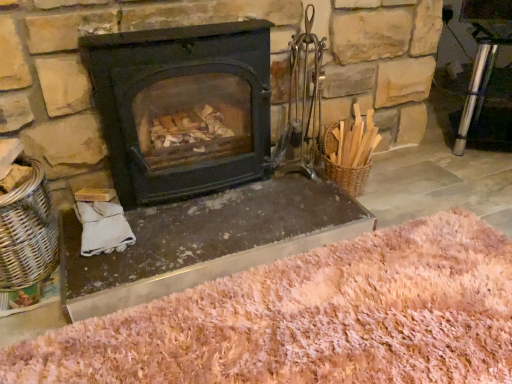
Measure the distance between point (321,204) and camera.

The depth of point (321,204) is 5.09 feet.

Where is `pink shaggy rug at lower center`? The width and height of the screenshot is (512, 384). pink shaggy rug at lower center is located at coordinates (310, 319).

Which is in front, matte black wood burning stove at center or woven wicker basket at left?

woven wicker basket at left is in front.

Does point (117, 50) lie behind point (41, 224)?

No, (117, 50) is closer to viewer.

Is matte black wood burning stove at center oriented away from woven wicker basket at left?

No, matte black wood burning stove at center is not facing away from woven wicker basket at left.

Which of these two, matte black wood burning stove at center or woven wicker basket at left, is thinner?

With smaller width is matte black wood burning stove at center.

How different are the orientations of woven wicker basket at left and metallic gray fireplace at center in degrees?

87.9 degrees separate the facing orientations of woven wicker basket at left and metallic gray fireplace at center.

Does woven wicker basket at left appear on the left side of metallic gray fireplace at center?

Yes, woven wicker basket at left is to the left of metallic gray fireplace at center.

Are woven wicker basket at left and metallic gray fireplace at center making contact?

No.

In order to click on table that is behind the woven wicker basket at left in this screenshot , I will do `click(205, 241)`.

Can you confirm if matte black wood burning stove at center is taller than pink shaggy rug at lower center?

Yes.

Between matte black wood burning stove at center and pink shaggy rug at lower center, which one has smaller width?

A: With smaller width is matte black wood burning stove at center.

Is matte black wood burning stove at center at the left side of pink shaggy rug at lower center?

Correct, you'll find matte black wood burning stove at center to the left of pink shaggy rug at lower center.

Is matte black wood burning stove at center beside pink shaggy rug at lower center?

No.

Is pink shaggy rug at lower center in front of or behind metallic gray fireplace at center in the image?

pink shaggy rug at lower center is positioned closer to the viewer than metallic gray fireplace at center.

From the image's perspective, relative to metallic gray fireplace at center, is pink shaggy rug at lower center above or below?

pink shaggy rug at lower center is situated lower than metallic gray fireplace at center in the image.

What's the angular difference between metallic gray fireplace at center and matte black wood burning stove at center's facing directions?

metallic gray fireplace at center and matte black wood burning stove at center are facing 93.1 degrees away from each other.

Does metallic gray fireplace at center have a lesser width compared to matte black wood burning stove at center?

In fact, metallic gray fireplace at center might be wider than matte black wood burning stove at center.

Can matte black wood burning stove at center be found inside metallic gray fireplace at center?

No, matte black wood burning stove at center is located outside of metallic gray fireplace at center.

Does metallic gray fireplace at center turn towards matte black wood burning stove at center?

No, metallic gray fireplace at center is not facing towards matte black wood burning stove at center.

Considering the positions of point (13, 241) and point (129, 97), is point (13, 241) closer or farther from the camera than point (129, 97)?

Point (13, 241).

Image resolution: width=512 pixels, height=384 pixels. I want to click on basket that appears on the left of matte black wood burning stove at center, so click(x=27, y=231).

Between woven wicker basket at left and matte black wood burning stove at center, which one appears on the right side from the viewer's perspective?

matte black wood burning stove at center.

From the image's perspective, does pink shaggy rug at lower center appear lower than woven wicker basket at left?

Yes.

Does pink shaggy rug at lower center contain woven wicker basket at left?

Definitely not — woven wicker basket at left is not inside pink shaggy rug at lower center.

Consider the image. Is pink shaggy rug at lower center facing towards woven wicker basket at left?

No.

Who is taller, pink shaggy rug at lower center or woven wicker basket at left?

With more height is woven wicker basket at left.

You are a GUI agent. You are given a task and a screenshot of the screen. Output one action in this format:
    pyautogui.click(x=<x>, y=<y>)
    Task: Click on the wood burning stove behind the woven wicker basket at left
    The image size is (512, 384).
    Given the screenshot: What is the action you would take?
    pyautogui.click(x=182, y=108)

In the image, there is a woven wicker basket at left. Where is `table below it (from the image's perspective)`? Image resolution: width=512 pixels, height=384 pixels. table below it (from the image's perspective) is located at coordinates (205, 241).

When comparing their distances from metallic gray fireplace at center, does pink shaggy rug at lower center or woven wicker basket at left seem closer?

Based on the image, pink shaggy rug at lower center appears to be nearer to metallic gray fireplace at center.

Based on their spatial positions, is metallic gray fireplace at center or matte black wood burning stove at center closer to woven wicker basket at left?

metallic gray fireplace at center is closer to woven wicker basket at left.

Estimate the real-world distances between objects in this image. Which object is closer to woven wicker basket at left, matte black wood burning stove at center or pink shaggy rug at lower center?

matte black wood burning stove at center is closer to woven wicker basket at left.

Considering their positions, is pink shaggy rug at lower center positioned closer to matte black wood burning stove at center than woven wicker basket at left?

woven wicker basket at left.

From the picture: From the image, which object appears to be farther from pink shaggy rug at lower center, metallic gray fireplace at center or woven wicker basket at left?

Among the two, woven wicker basket at left is located further to pink shaggy rug at lower center.

Based on the photo, considering their positions, is matte black wood burning stove at center positioned further to metallic gray fireplace at center than woven wicker basket at left?

Among the two, woven wicker basket at left is located further to metallic gray fireplace at center.

Based on their spatial positions, is pink shaggy rug at lower center or matte black wood burning stove at center closer to metallic gray fireplace at center?

Among the two, pink shaggy rug at lower center is located nearer to metallic gray fireplace at center.

When comparing their distances from matte black wood burning stove at center, does metallic gray fireplace at center or pink shaggy rug at lower center seem closer?

metallic gray fireplace at center.

This screenshot has width=512, height=384. Identify the location of table between woven wicker basket at left and pink shaggy rug at lower center from left to right. (205, 241).

Image resolution: width=512 pixels, height=384 pixels. I want to click on wood burning stove situated between woven wicker basket at left and pink shaggy rug at lower center from left to right, so click(182, 108).

This screenshot has height=384, width=512. I want to click on table between matte black wood burning stove at center and pink shaggy rug at lower center in the up-down direction, so click(205, 241).

In order to click on wood burning stove situated between woven wicker basket at left and metallic gray fireplace at center from left to right in this screenshot , I will do tap(182, 108).